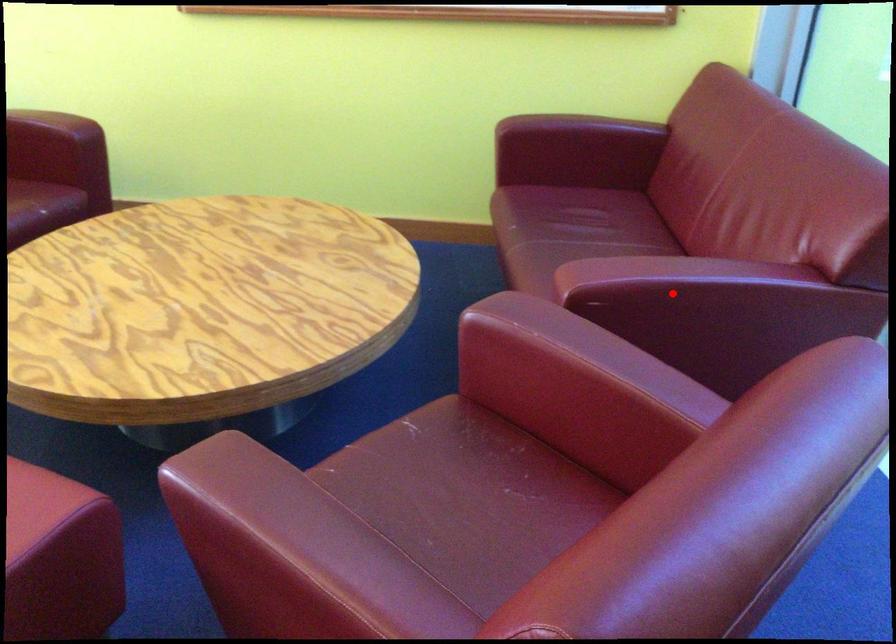
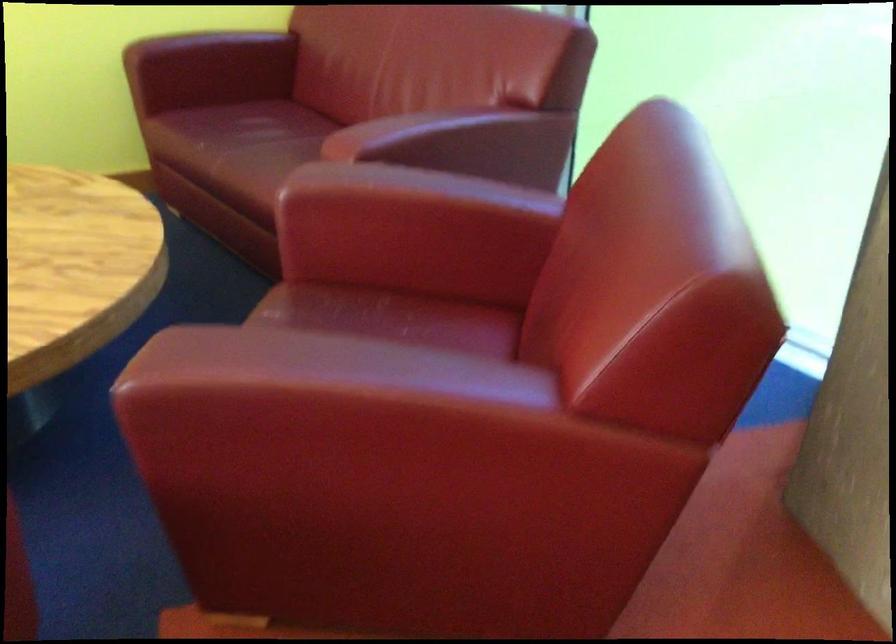
Question: I am providing you with two images of the same scene from different viewpoints. Image1 has a red point marked. In image2, the corresponding 3D location appears at what relative position? Reply with the corresponding letter.

Choices:
 (A) Closer
 (B) Farther

Answer: (B)